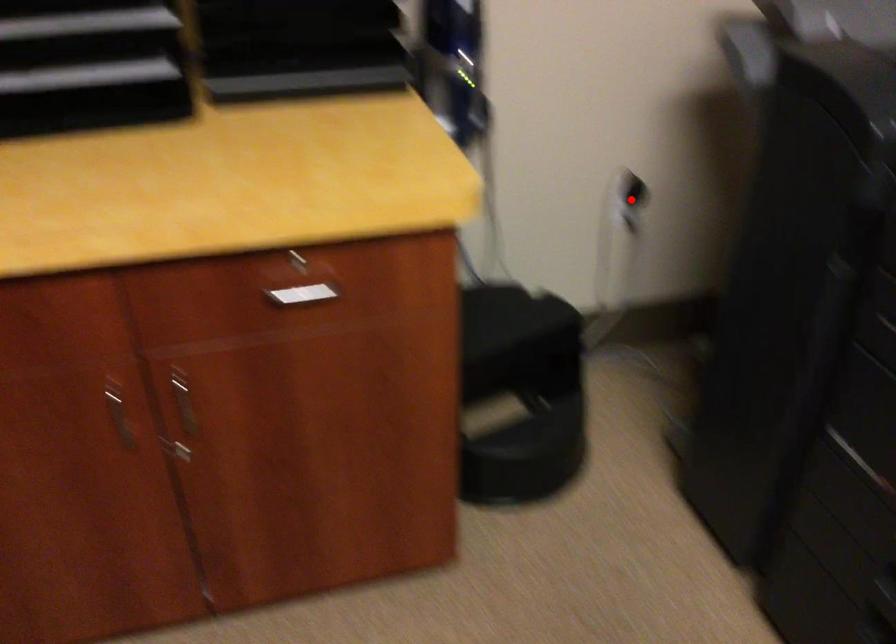
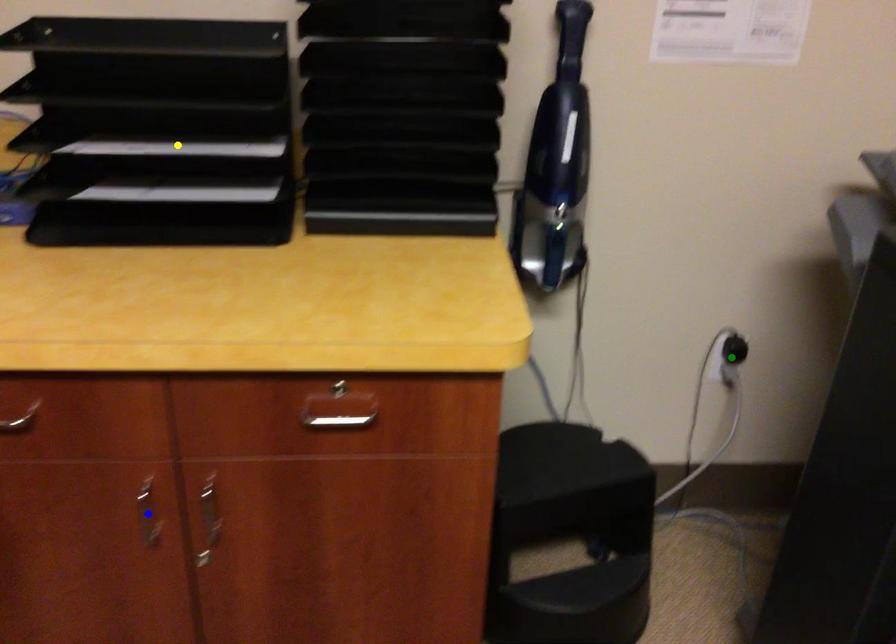
Question: I am providing you with two images of the same scene from different viewpoints. A red point is marked on the first image. You are given multiple points on the second image. In image 2, which mark is for the same physical point as the one in image 1?

Choices:
 (A) blue point
 (B) yellow point
 (C) green point

Answer: (C)